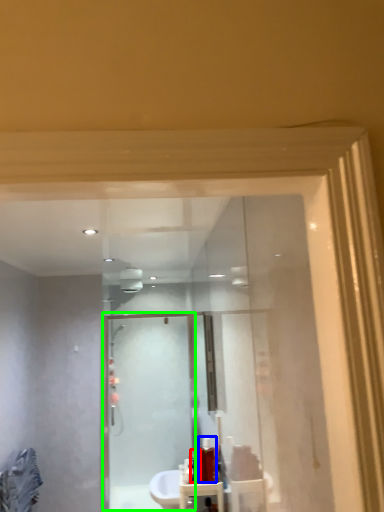
Question: Which object is positioned farthest from toiletry (highlighted by a red box)? Select from toiletry (highlighted by a blue box) and screen door (highlighted by a green box).

Choices:
 (A) toiletry
 (B) screen door

Answer: (B)